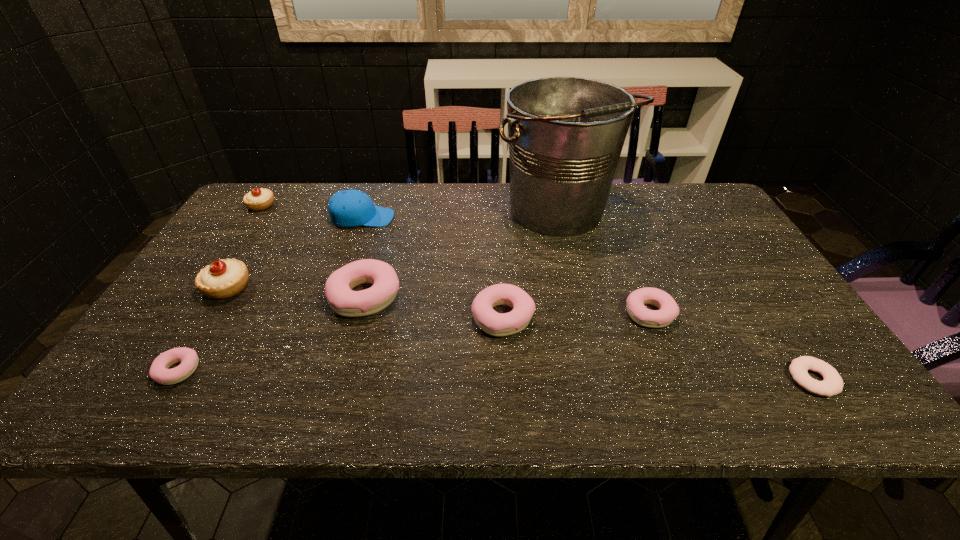
This screenshot has width=960, height=540. I want to click on the rightmost pastry, so click(668, 310).

Where is `the seventh tallest object`? This screenshot has height=540, width=960. the seventh tallest object is located at coordinates (668, 310).

I want to click on the leftmost pink pastry, so click(x=159, y=372).

This screenshot has height=540, width=960. I want to click on the nearest pastry, so click(159, 372).

The width and height of the screenshot is (960, 540). I want to click on doughnut, so click(x=832, y=384).

Image resolution: width=960 pixels, height=540 pixels. I want to click on the rightmost object, so click(832, 384).

Image resolution: width=960 pixels, height=540 pixels. In order to click on free region located 0.270m on the right of the bucket in this screenshot , I will do `click(708, 212)`.

What are the coordinates of `vacant space located 0.150m on the front-facing side of the blue cap` in the screenshot? It's located at (x=443, y=218).

The width and height of the screenshot is (960, 540). What are the coordinates of `free spot located 0.280m on the front of the nearer beige pastry` in the screenshot? It's located at (156, 404).

You are a GUI agent. You are given a task and a screenshot of the screen. Output one action in this format:
    pyautogui.click(x=<x>, y=<y>)
    Task: Click on the vacant area situated 0.120m on the right of the farther beige pastry
    The width and height of the screenshot is (960, 540).
    Given the screenshot: What is the action you would take?
    pyautogui.click(x=313, y=205)